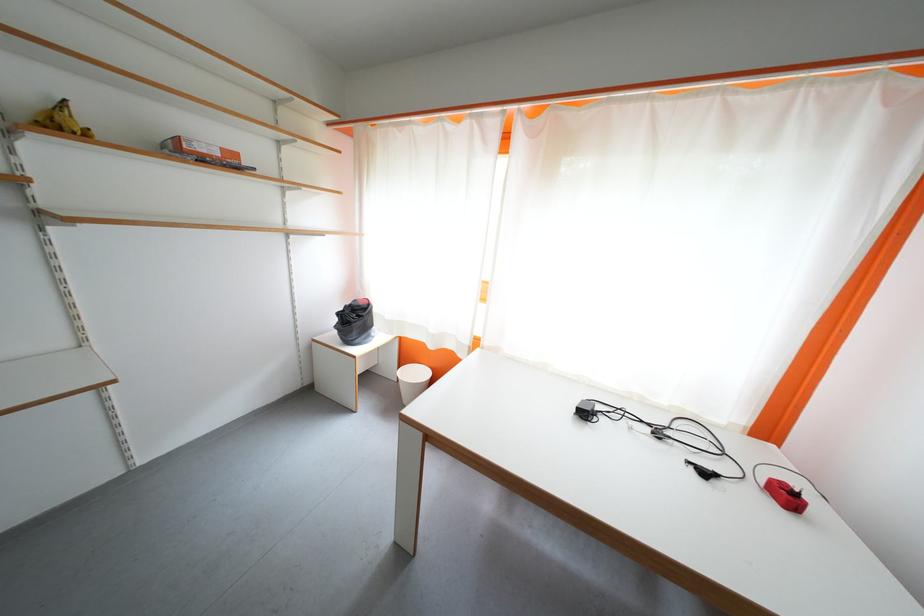
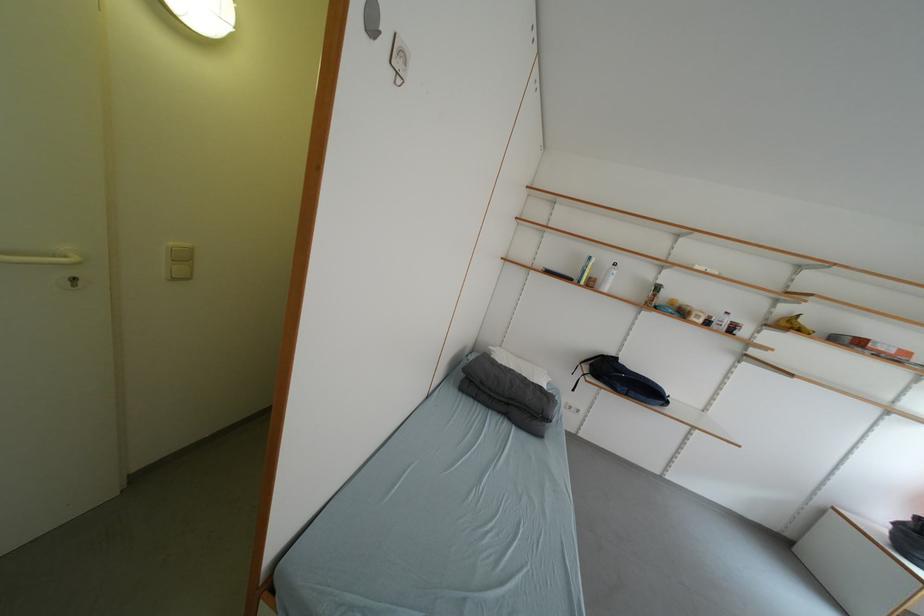
Where in the second image is the point corresponding to point (319, 351) from the first image?

(832, 515)